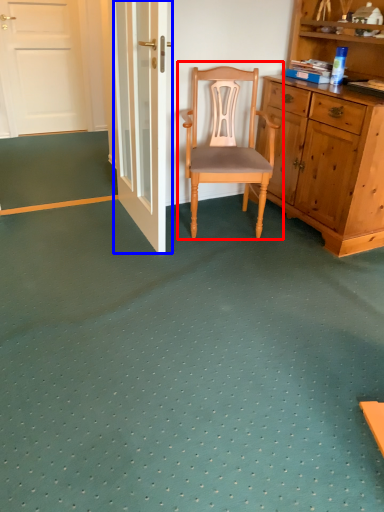
Question: Which point is closer to the camera, chair (highlighted by a red box) or door (highlighted by a blue box)?

Choices:
 (A) chair
 (B) door

Answer: (B)